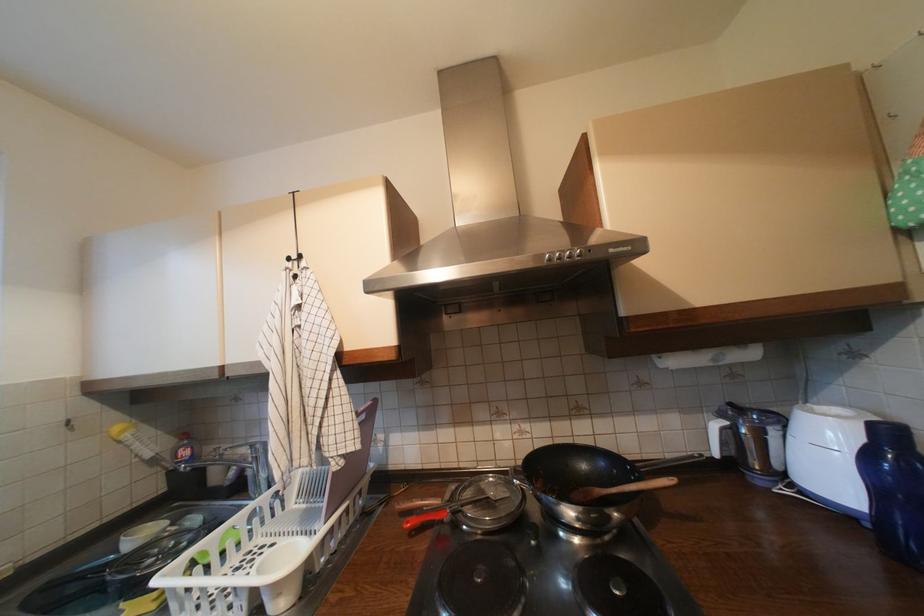
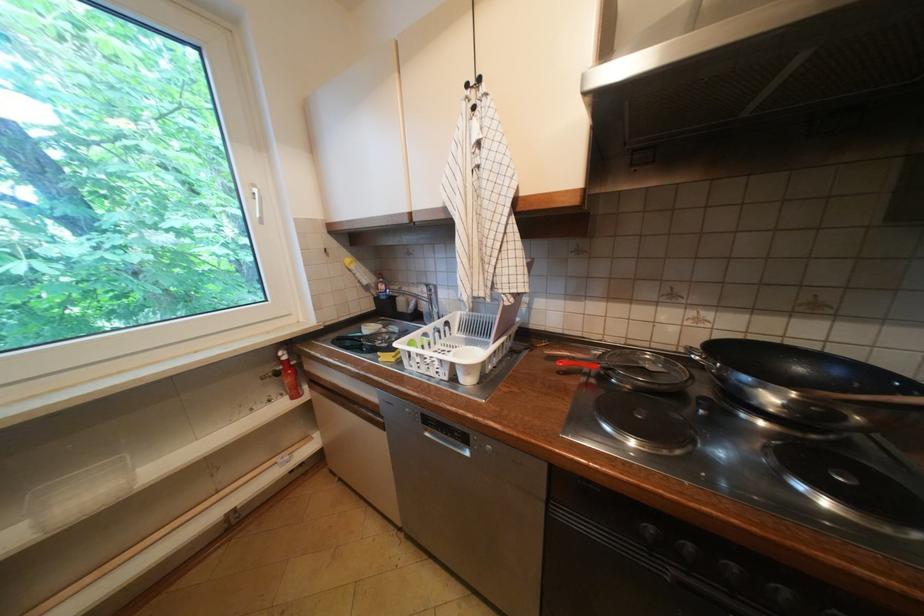
The first image is from the beginning of the video and the second image is from the end. How did the camera likely rotate when shooting the video?

The rotation direction of the camera is left-down.